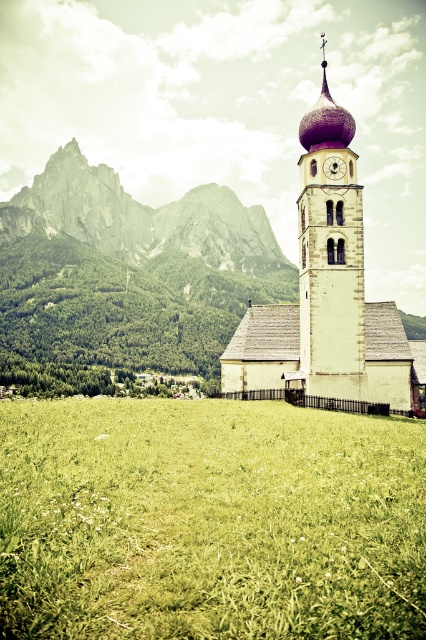
Where is `gray rock formation at upper left`? The width and height of the screenshot is (426, 640). gray rock formation at upper left is located at coordinates (x=141, y=218).

Which is behind, point (37, 182) or point (339, 163)?

The point (37, 182) is behind.

Is point (215, 192) more distant than point (336, 177)?

Yes, it is.

Identify the location of gray rock formation at upper left. The image size is (426, 640). (141, 218).

Which of these two, gray rock formation at upper left or smooth stone clock tower at center, stands taller?

gray rock formation at upper left is taller.

Who is positioned more to the left, gray rock formation at upper left or smooth stone clock tower at center?

gray rock formation at upper left

This screenshot has width=426, height=640. In order to click on gray rock formation at upper left in this screenshot , I will do `click(141, 218)`.

Between point (259, 586) and point (37, 180), which one is positioned in front?

Positioned in front is point (259, 586).

Consider the image. Is green grass at center wider than gray rock formation at upper left?

No, green grass at center is not wider than gray rock formation at upper left.

At what (x,y) coordinates should I click in order to perform the action: click on green grass at center. Please return your answer as a coordinate pair (x, y). The width and height of the screenshot is (426, 640). Looking at the image, I should click on (209, 522).

Where is `green grass at center`? green grass at center is located at coordinates tap(209, 522).